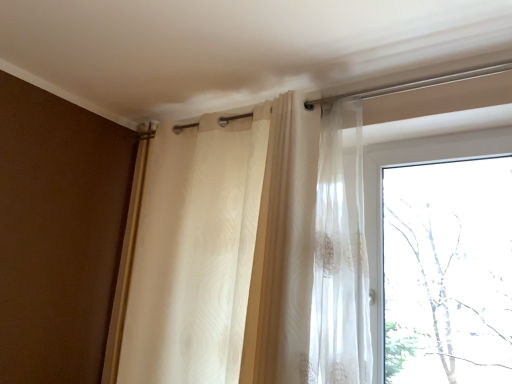
Question: In the image, is translucent fabric curtain at upper center positioned in front of or behind transparent glass window at upper right?

Choices:
 (A) front
 (B) behind

Answer: (A)

Question: Considering the positions of point (x=183, y=269) and point (x=472, y=120), is point (x=183, y=269) closer or farther from the camera than point (x=472, y=120)?

Choices:
 (A) farther
 (B) closer

Answer: (A)

Question: In terms of size, does translucent fabric curtain at upper center appear bigger or smaller than transparent glass window at upper right?

Choices:
 (A) big
 (B) small

Answer: (A)

Question: Is point pos(490,66) positioned closer to the camera than point pos(217,145)?

Choices:
 (A) farther
 (B) closer

Answer: (B)

Question: Looking at the image, does transparent glass window at upper right seem bigger or smaller compared to translucent fabric curtain at upper center?

Choices:
 (A) small
 (B) big

Answer: (A)

Question: From the image's perspective, is transparent glass window at upper right above or below translucent fabric curtain at upper center?

Choices:
 (A) above
 (B) below

Answer: (B)

Question: Relative to translucent fabric curtain at upper center, is transparent glass window at upper right in front or behind?

Choices:
 (A) front
 (B) behind

Answer: (B)